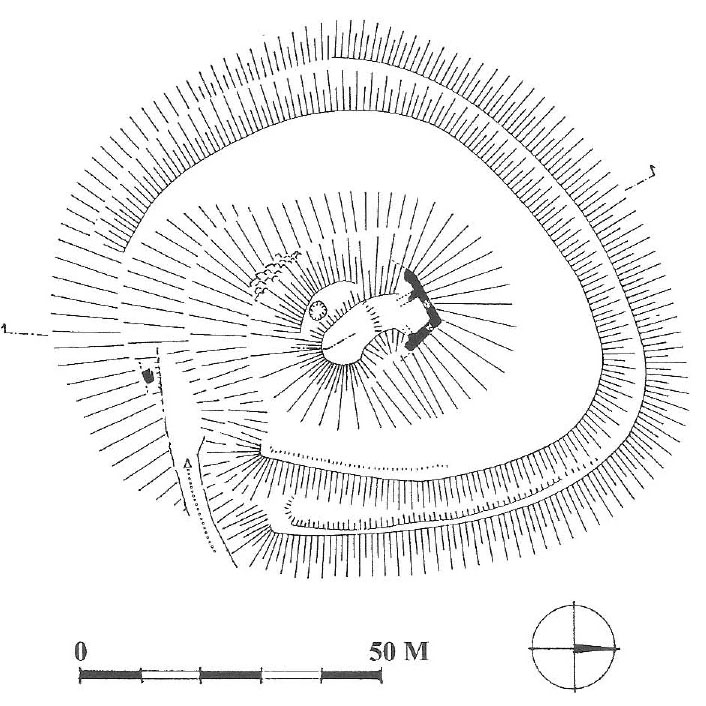
The width and height of the screenshot is (706, 706). Find the location of `divider`. divider is located at coordinates (140, 673).